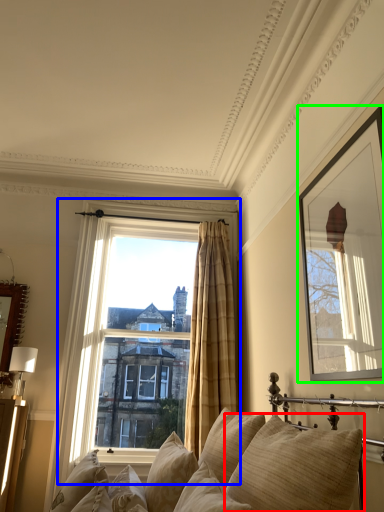
Question: Which is nearer to the pillow (highlighted by a red box)? window (highlighted by a blue box) or picture frame (highlighted by a green box).

Choices:
 (A) window
 (B) picture frame

Answer: (B)